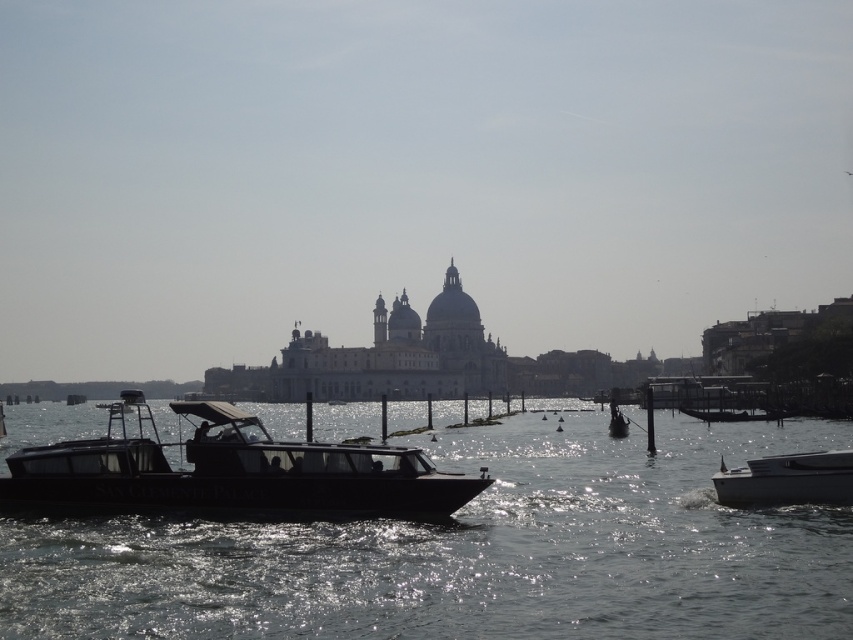
In the scene shown: You are standing on a bridge overlooking the waterway and want to take a photo of the transparent water at center and the black matte boat at center. Which object will appear larger in your photo?

The transparent water at center will appear larger in the photo because it is closer to the viewer than the black matte boat at center.

You are standing on the dock and want to reach a specific point in the water marked at coordinates point [242,493]. If your swimming range is 75 meters, can you reach that point?

The distance of point [242,493] from viewer is 74.82 meters, so yes, you can reach that point since it is within your swimming range of 75 meters.